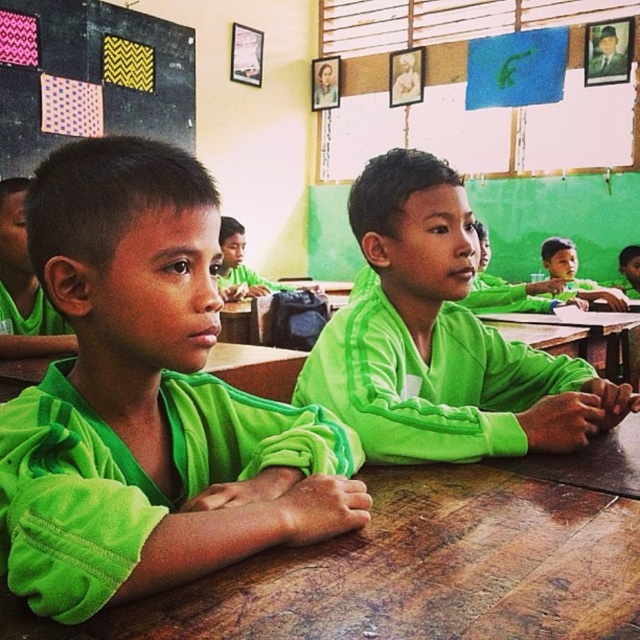
Does green matte jacket at center have a lesser height compared to green matte jacket at left?

Yes, green matte jacket at center is shorter than green matte jacket at left.

Does green matte jacket at center appear on the left side of green matte jacket at left?

No, green matte jacket at center is not to the left of green matte jacket at left.

Measure the distance between point (202, 336) and camera.

Point (202, 336) and camera are 29.52 inches apart from each other.

Where is `green matte jacket at center`? green matte jacket at center is located at coordinates 147,401.

Can you confirm if green fleece jacket at center is shorter than patterned fabric at upper left?

Yes, green fleece jacket at center is shorter than patterned fabric at upper left.

Locate an element on the screen. The width and height of the screenshot is (640, 640). green fleece jacket at center is located at coordinates click(x=440, y=339).

Does point (84, 586) lie behind point (556, 246)?

No.

Between green matte jacket at center and green fabric shirt at center, which one has more height?

green matte jacket at center

Between point (324, 508) and point (541, 241), which one is positioned in front?

Point (324, 508) is in front.

Locate an element on the screen. This screenshot has height=640, width=640. green matte jacket at center is located at coordinates (147, 401).